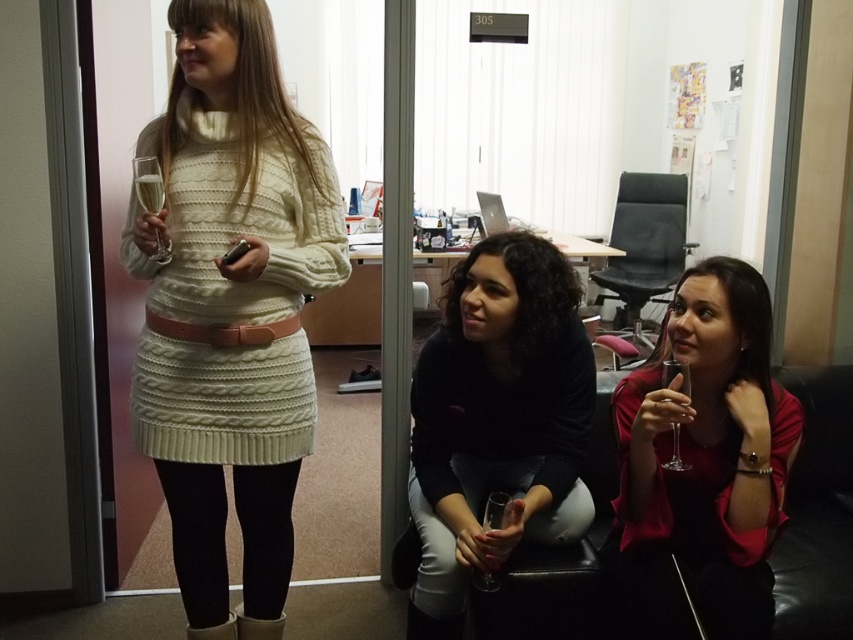
Question: Does white knitted dress at center have a greater width compared to black matte shirt at center?

Choices:
 (A) yes
 (B) no

Answer: (B)

Question: Does black matte shirt at center appear over matte red dress at lower right?

Choices:
 (A) no
 (B) yes

Answer: (A)

Question: Estimate the real-world distances between objects in this image. Which object is closer to the clear glass at upper left?

Choices:
 (A) matte red dress at lower right
 (B) black matte shirt at center
 (C) white knitted dress at center

Answer: (C)

Question: Which object appears farthest from the camera in this image?

Choices:
 (A) white knitted dress at center
 (B) black matte shirt at center
 (C) matte red dress at lower right
 (D) clear glass at upper left

Answer: (B)

Question: Does white knitted dress at center have a greater width compared to black matte shirt at center?

Choices:
 (A) yes
 (B) no

Answer: (B)

Question: Which is farther from the black matte shirt at center?

Choices:
 (A) white knitted dress at center
 (B) matte red dress at lower right
 (C) clear glass at upper left

Answer: (C)